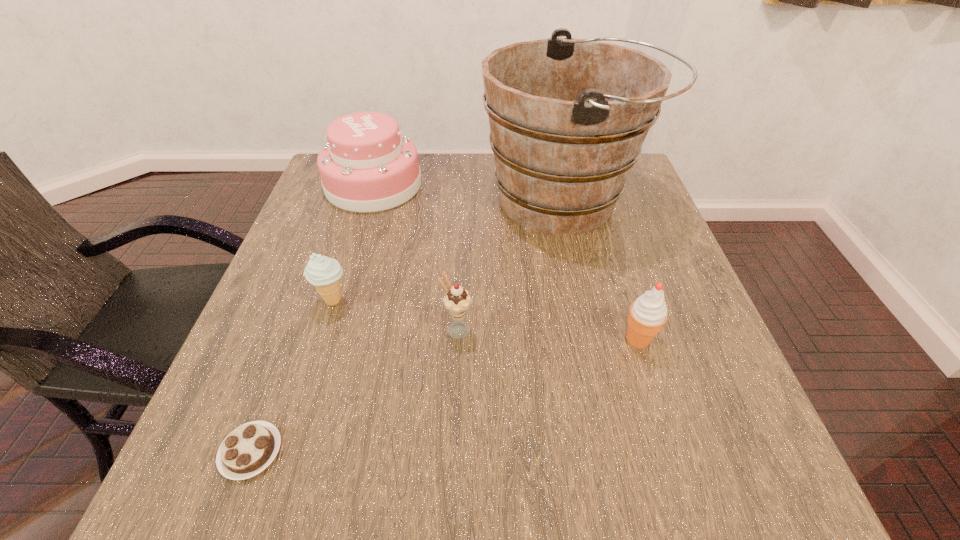
Where is `free space located on the left of the fourth object from left to right`? free space located on the left of the fourth object from left to right is located at coordinates (331, 330).

Where is `vacant space located 0.310m on the front of the fourth nearest object`? Image resolution: width=960 pixels, height=540 pixels. vacant space located 0.310m on the front of the fourth nearest object is located at coordinates (278, 472).

Locate an element on the screen. The height and width of the screenshot is (540, 960). vacant area located 0.140m on the right of the chocolate cake is located at coordinates (371, 451).

Identify the location of bucket that is positioned at the far edge. (568, 117).

I want to click on cake at the far edge, so click(367, 165).

What are the coordinates of `object that is positioned at the near edge` in the screenshot? It's located at (250, 448).

The image size is (960, 540). In order to click on cake present at the left edge in this screenshot , I will do `click(367, 165)`.

Identify the location of icecream positioned at the left edge. This screenshot has width=960, height=540. (323, 272).

Image resolution: width=960 pixels, height=540 pixels. Find the location of `chocolate cake that is positioned at the left edge`. chocolate cake that is positioned at the left edge is located at coordinates (250, 448).

This screenshot has width=960, height=540. What are the coordinates of `bucket that is at the right edge` in the screenshot? It's located at (568, 117).